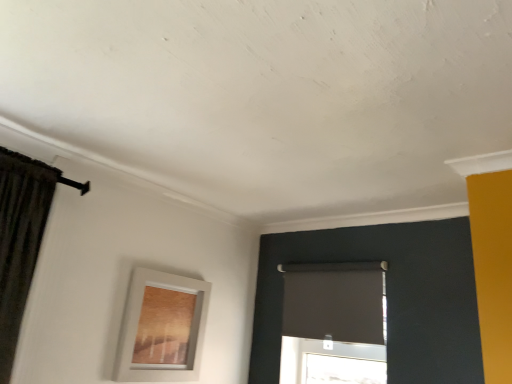
Locate an element on the screen. white matte picture frame at lower left is located at coordinates (162, 328).

The height and width of the screenshot is (384, 512). What do you see at coordinates (162, 328) in the screenshot?
I see `white matte picture frame at lower left` at bounding box center [162, 328].

What is the approximate height of matte black roller shade at center?

It is 41.00 centimeters.

This screenshot has width=512, height=384. What do you see at coordinates (334, 323) in the screenshot? I see `matte black roller shade at center` at bounding box center [334, 323].

This screenshot has height=384, width=512. I want to click on matte black roller shade at center, so click(334, 323).

The image size is (512, 384). Find the location of `white matte picture frame at lower left`. white matte picture frame at lower left is located at coordinates (162, 328).

Is white matte picture frame at lower left at the left side of matte black roller shade at center?

Yes.

Considering the positions of objects white matte picture frame at lower left and matte black roller shade at center in the image provided, who is behind, white matte picture frame at lower left or matte black roller shade at center?

matte black roller shade at center is behind.

Does point (181, 315) appear closer or farther from the camera than point (312, 340)?

Point (181, 315) appears to be closer to the viewer than point (312, 340).

From the image's perspective, relative to matte black roller shade at center, is white matte picture frame at lower left above or below?

From the image's perspective, white matte picture frame at lower left appears below matte black roller shade at center.

From a real-world perspective, is white matte picture frame at lower left above or below matte black roller shade at center?

From a real-world perspective, white matte picture frame at lower left is physically below matte black roller shade at center.

Can you confirm if white matte picture frame at lower left is thinner than matte black roller shade at center?

No.

Can you confirm if white matte picture frame at lower left is taller than matte black roller shade at center?

Indeed, white matte picture frame at lower left has a greater height compared to matte black roller shade at center.

Who is smaller, white matte picture frame at lower left or matte black roller shade at center?

Smaller between the two is white matte picture frame at lower left.

Does white matte picture frame at lower left contain matte black roller shade at center?

No, matte black roller shade at center is located outside of white matte picture frame at lower left.

Is white matte picture frame at lower left not near matte black roller shade at center?

No, white matte picture frame at lower left is not far from matte black roller shade at center.

Could you tell me if white matte picture frame at lower left is facing matte black roller shade at center?

No, white matte picture frame at lower left is not turned towards matte black roller shade at center.

Locate an element on the screen. window that appears on the right of white matte picture frame at lower left is located at coordinates (334, 323).

Considering the positions of objects matte black roller shade at center and white matte picture frame at lower left in the image provided, who is more to the right, matte black roller shade at center or white matte picture frame at lower left?

Positioned to the right is matte black roller shade at center.

Consider the image. Is matte black roller shade at center in front of white matte picture frame at lower left?

No, it is behind white matte picture frame at lower left.

Between point (287, 327) and point (149, 337), which one is positioned behind?

The point (287, 327) is farther from the camera.

From the image's perspective, is matte black roller shade at center located above white matte picture frame at lower left?

Yes.

From a real-world perspective, relative to white matte picture frame at lower left, is matte black roller shade at center vertically above or below?

matte black roller shade at center is situated higher than white matte picture frame at lower left in the real world.

Considering the sizes of matte black roller shade at center and white matte picture frame at lower left in the image, is matte black roller shade at center wider or thinner than white matte picture frame at lower left?

Considering their sizes, matte black roller shade at center looks slimmer than white matte picture frame at lower left.

In terms of height, does matte black roller shade at center look taller or shorter compared to white matte picture frame at lower left?

Clearly, matte black roller shade at center is shorter compared to white matte picture frame at lower left.

Between matte black roller shade at center and white matte picture frame at lower left, which one has smaller size?

With smaller size is white matte picture frame at lower left.

Do you think matte black roller shade at center is within white matte picture frame at lower left, or outside of it?

matte black roller shade at center cannot be found inside white matte picture frame at lower left.

Is matte black roller shade at center positioned far away from white matte picture frame at lower left?

They are positioned close to each other.

Is matte black roller shade at center aimed at white matte picture frame at lower left?

Yes.

Where is `picture frame located underneath the matte black roller shade at center (from a real-world perspective)`? The height and width of the screenshot is (384, 512). picture frame located underneath the matte black roller shade at center (from a real-world perspective) is located at coordinates click(x=162, y=328).

I want to click on picture frame in front of the matte black roller shade at center, so click(162, 328).

You are a GUI agent. You are given a task and a screenshot of the screen. Output one action in this format:
    pyautogui.click(x=<x>, y=<y>)
    Task: Click on the window located on the right of white matte picture frame at lower left
    This screenshot has height=384, width=512.
    Given the screenshot: What is the action you would take?
    pyautogui.click(x=334, y=323)